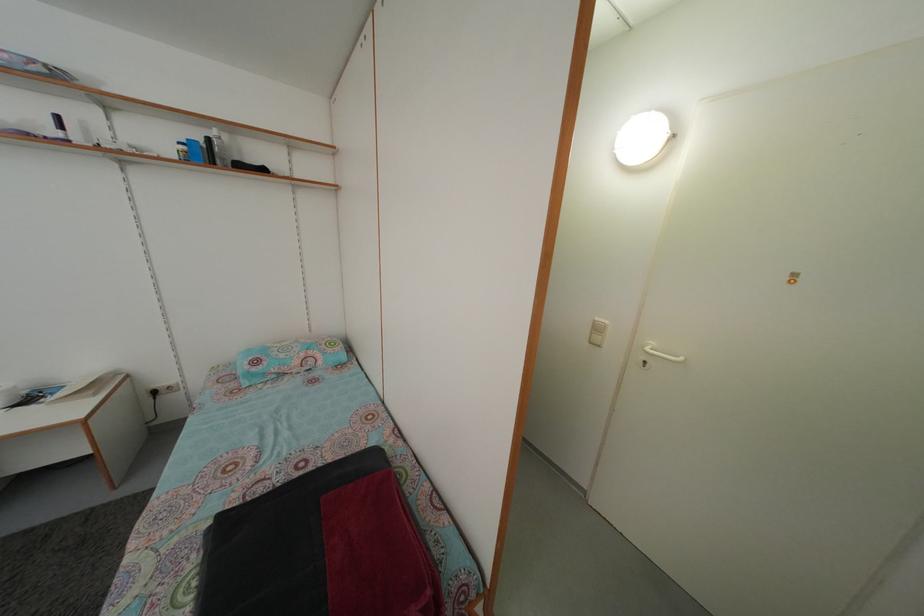
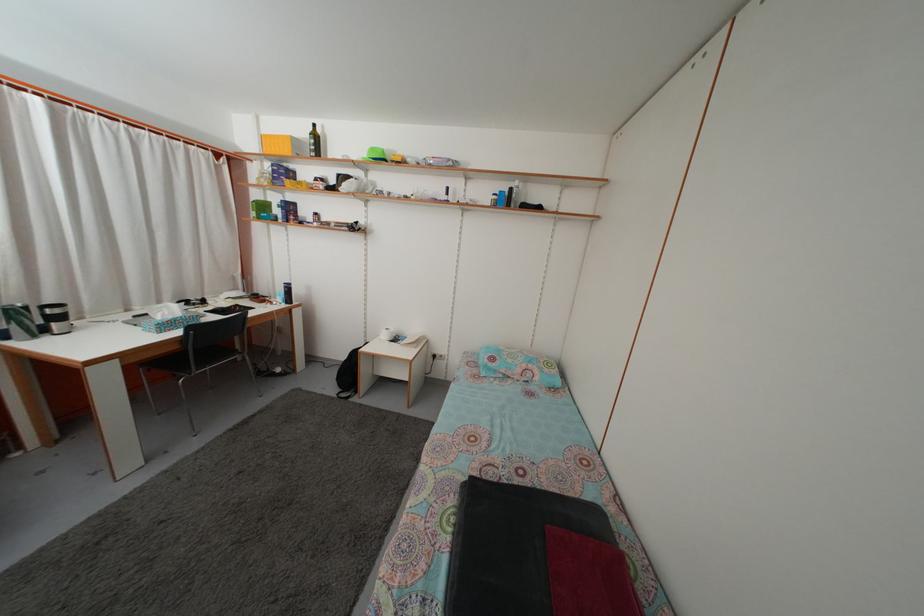
Question: The first image is from the beginning of the video and the second image is from the end. How did the camera likely rotate when shooting the video?

Choices:
 (A) Left
 (B) Right
 (C) Up
 (D) Down

Answer: (A)